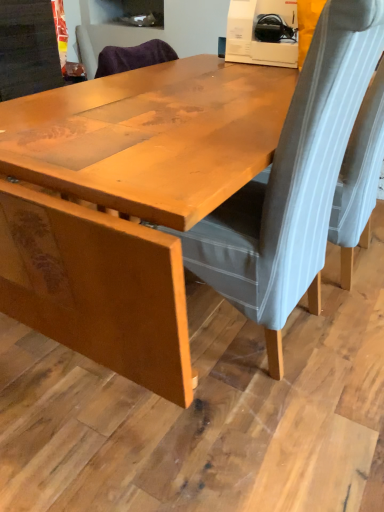
At what (x,y) coordinates should I click in order to perform the action: click on free location in front of velvet grey chair at center, the second chair in the right-to-left sequence. Please return your answer as a coordinate pair (x, y). Image resolution: width=384 pixels, height=512 pixels. Looking at the image, I should click on (231, 435).